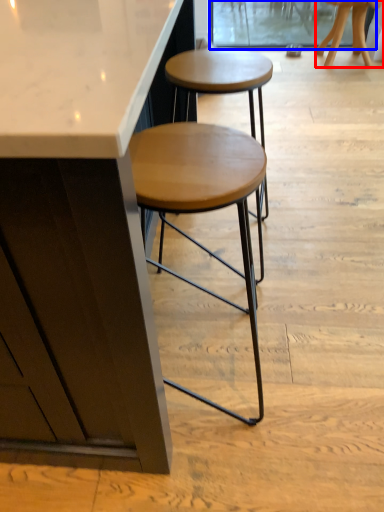
Question: Which object is further to the camera taking this photo, stool (highlighted by a red box) or screen door (highlighted by a blue box)?

Choices:
 (A) stool
 (B) screen door

Answer: (B)